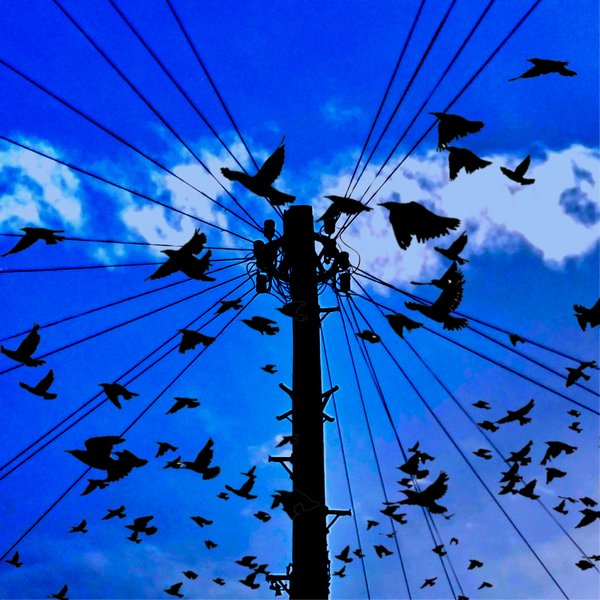
Locate an element on the screen. peg is located at coordinates [x=338, y=510], [x=329, y=419], [x=327, y=392], [x=287, y=392], [x=283, y=414], [x=284, y=457], [x=276, y=576].